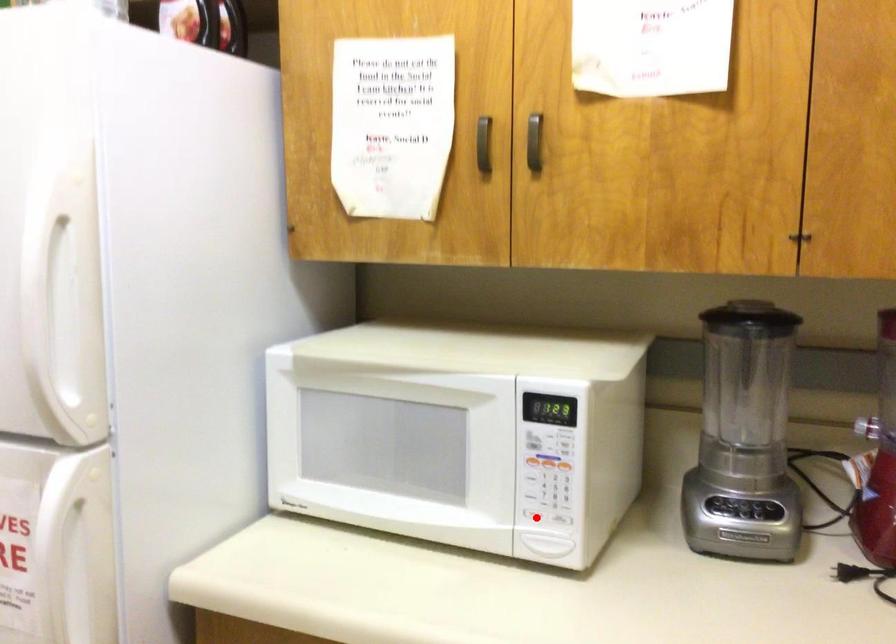
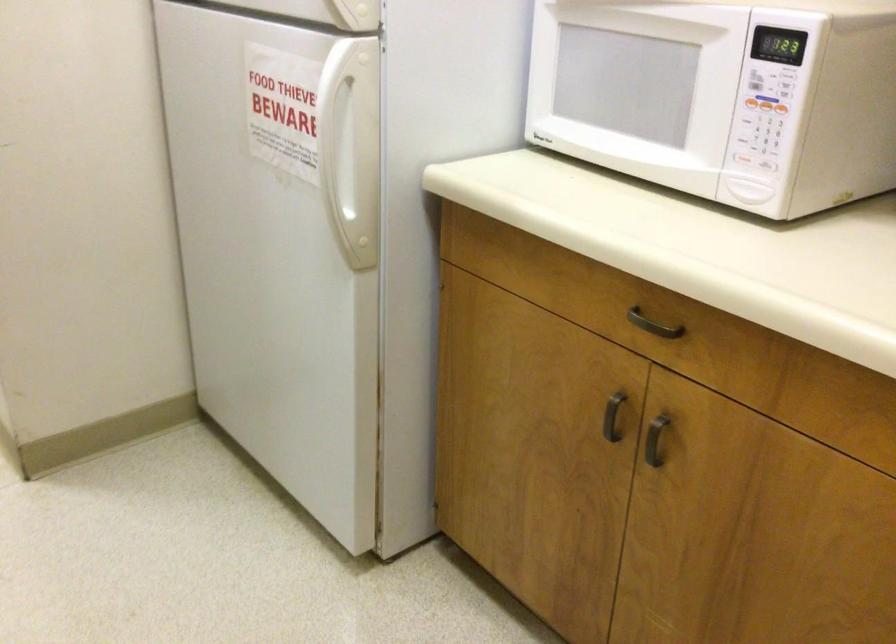
Where in the second image is the point corresponding to the highlighted location from the first image?

(741, 158)